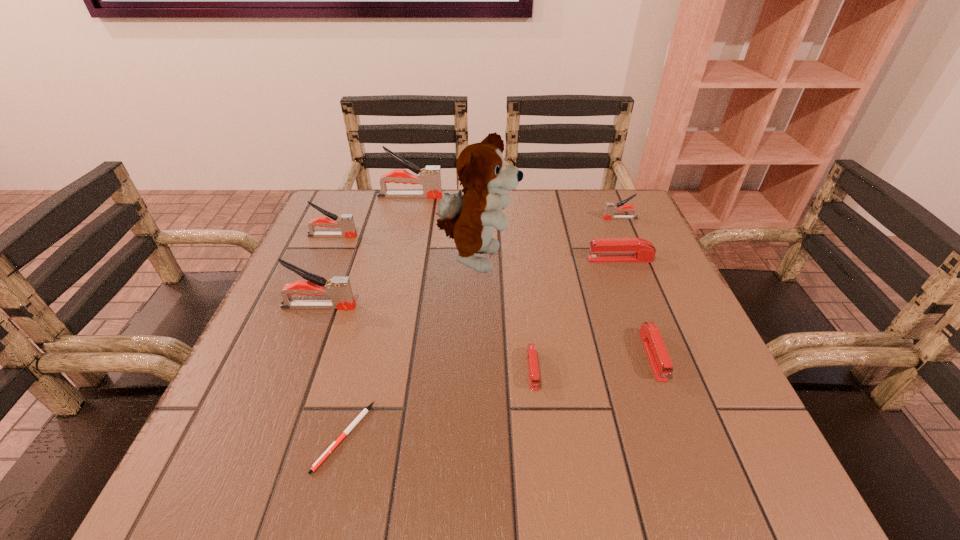
At what (x,y) coordinates should I click in order to perform the action: click on the farthest red stapler. Please return your answer as a coordinate pair (x, y). The width and height of the screenshot is (960, 540). Looking at the image, I should click on (604, 250).

The width and height of the screenshot is (960, 540). Find the location of `the fourth shortest object`. the fourth shortest object is located at coordinates (604, 250).

The width and height of the screenshot is (960, 540). Find the location of `the second shortest stapler`. the second shortest stapler is located at coordinates [658, 356].

You are a GUI agent. You are given a task and a screenshot of the screen. Output one action in this format:
    pyautogui.click(x=<x>, y=<y>)
    Task: Click on the second biggest red stapler
    This screenshot has height=540, width=960.
    Given the screenshot: What is the action you would take?
    pyautogui.click(x=658, y=356)

You are a GUI agent. You are given a task and a screenshot of the screen. Output one action in this format:
    pyautogui.click(x=<x>, y=<y>)
    Task: Click on the shortest stapler
    Image resolution: width=960 pixels, height=540 pixels.
    Given the screenshot: What is the action you would take?
    pyautogui.click(x=534, y=377)

In order to click on the leftmost red stapler in this screenshot , I will do `click(534, 377)`.

Identify the location of pen. This screenshot has height=540, width=960. (365, 411).

Where is `the shortest object`? The height and width of the screenshot is (540, 960). the shortest object is located at coordinates (365, 411).

What are the coordinates of `free location located on the face of the tallest object` in the screenshot? It's located at (598, 260).

Identify the location of vacant point located on the handle side of the farthest gray stapler. The height and width of the screenshot is (540, 960). (460, 197).